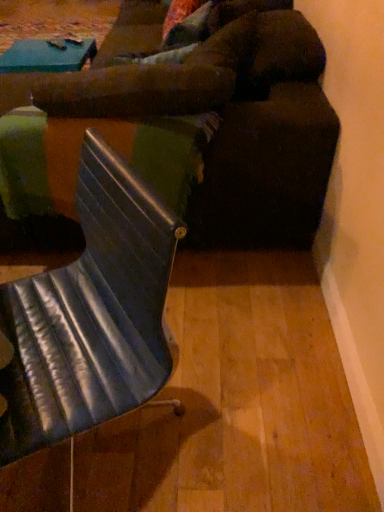
Question: Is the position of velvet brown couch at center more distant than that of metallic blue chair at center?

Choices:
 (A) yes
 (B) no

Answer: (A)

Question: Does velvet brown couch at center have a lesser height compared to metallic blue chair at center?

Choices:
 (A) no
 (B) yes

Answer: (A)

Question: From the image's perspective, would you say velvet brown couch at center is positioned over metallic blue chair at center?

Choices:
 (A) no
 (B) yes

Answer: (B)

Question: From the image's perspective, does velvet brown couch at center appear lower than metallic blue chair at center?

Choices:
 (A) no
 (B) yes

Answer: (A)

Question: Is velvet brown couch at center far from metallic blue chair at center?

Choices:
 (A) no
 (B) yes

Answer: (A)

Question: Is velvet brown couch at center closer to camera compared to metallic blue chair at center?

Choices:
 (A) no
 (B) yes

Answer: (A)

Question: Is metallic silver table at center bigger than velvet brown couch at center?

Choices:
 (A) yes
 (B) no

Answer: (B)

Question: Is velvet brown couch at center a part of metallic silver table at center?

Choices:
 (A) no
 (B) yes

Answer: (A)

Question: Considering the relative positions of metallic silver table at center and velvet brown couch at center in the image provided, is metallic silver table at center behind velvet brown couch at center?

Choices:
 (A) no
 (B) yes

Answer: (B)

Question: Is metallic silver table at center oriented away from velvet brown couch at center?

Choices:
 (A) yes
 (B) no

Answer: (A)

Question: Is metallic silver table at center smaller than velvet brown couch at center?

Choices:
 (A) yes
 (B) no

Answer: (A)

Question: Is metallic silver table at center far away from velvet brown couch at center?

Choices:
 (A) no
 (B) yes

Answer: (A)

Question: Can you confirm if metallic blue chair at center is shorter than metallic silver table at center?

Choices:
 (A) no
 (B) yes

Answer: (A)